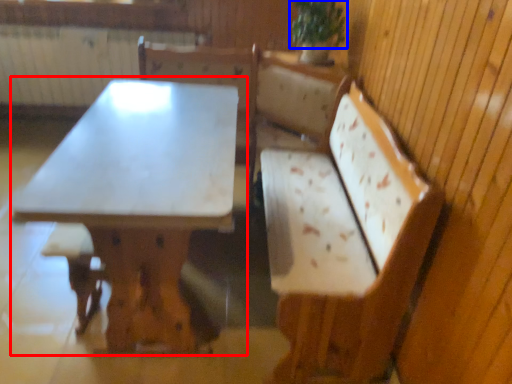
Question: Which object appears closest to the camera in this image, table (highlighted by a red box) or plant (highlighted by a blue box)?

Choices:
 (A) table
 (B) plant

Answer: (A)